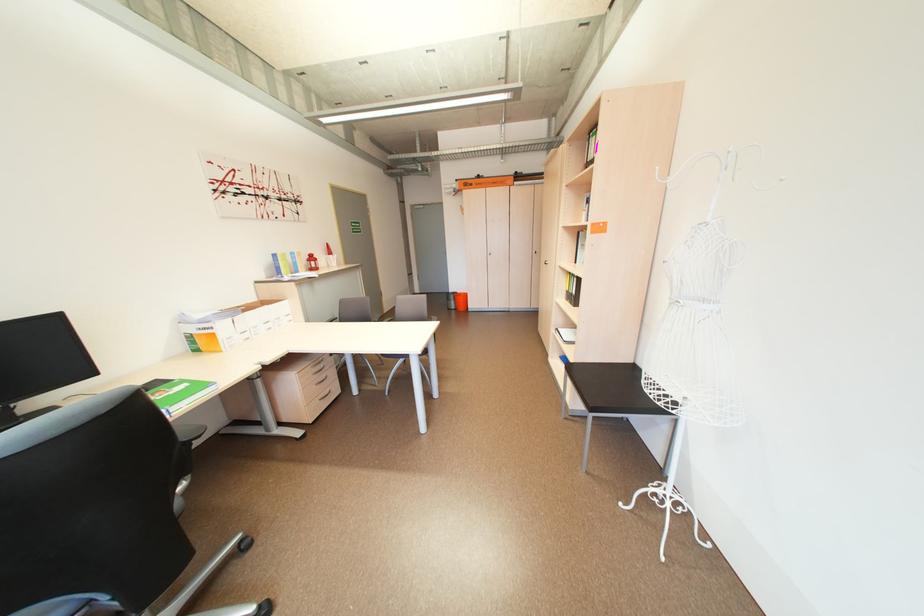
Image resolution: width=924 pixels, height=616 pixels. Identify the location of cabinet door handle. (545, 262).